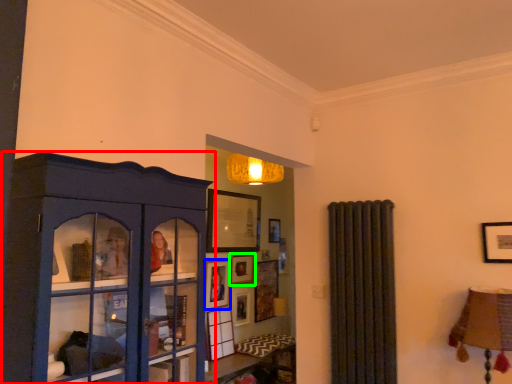
Question: Which object is the farthest from shelf (highlighted by a red box)? Choose among these: picture frame (highlighted by a blue box) or picture frame (highlighted by a green box).

Choices:
 (A) picture frame
 (B) picture frame

Answer: (B)